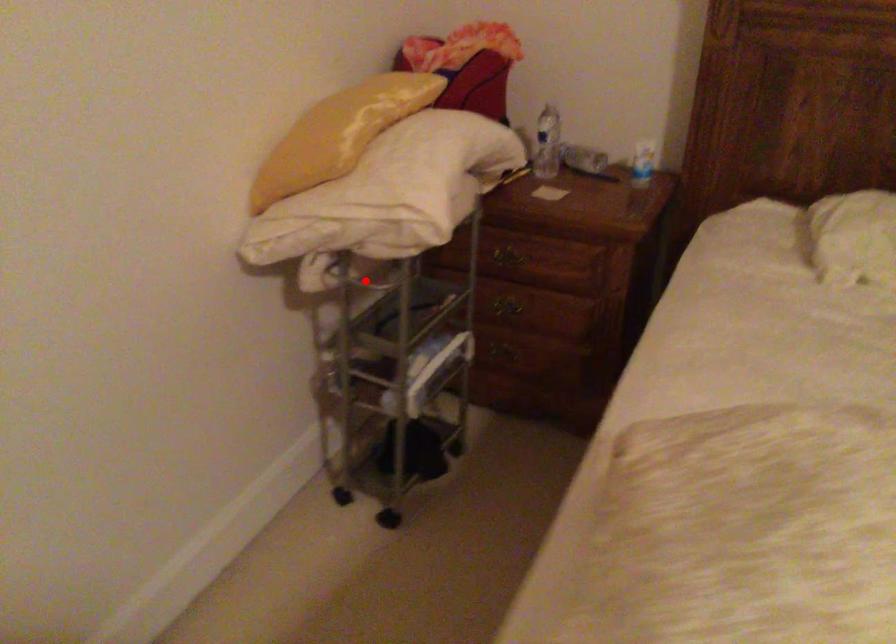
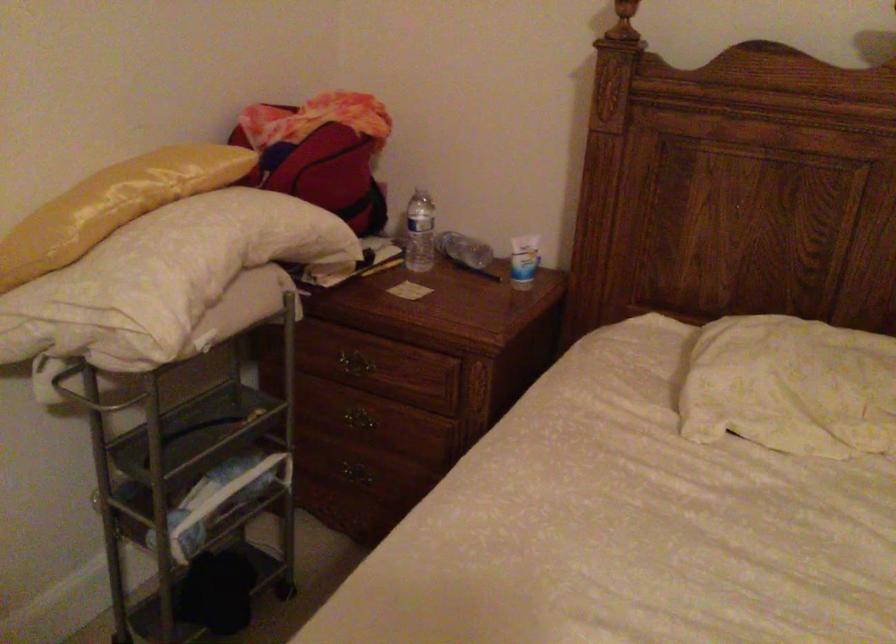
Find the pixel in the second image that matches the highlighted location in the first image.

(91, 393)